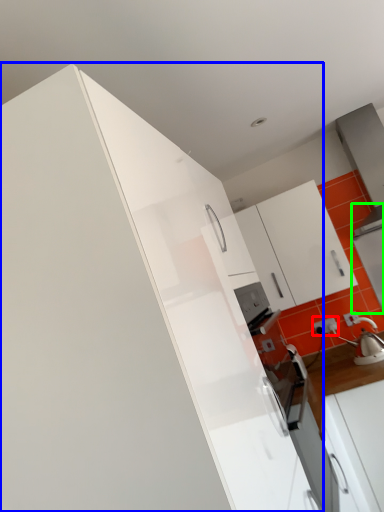
Question: Which is nearer to the electric outlet (highlighted by a red box)? cabinetry (highlighted by a blue box) or appliance (highlighted by a green box).

Choices:
 (A) cabinetry
 (B) appliance

Answer: (B)